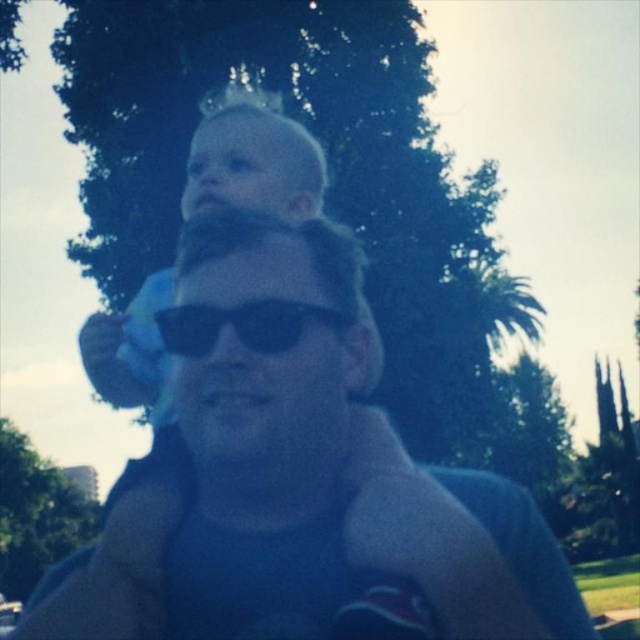
From the picture: Does blue fabric shirt at center have a greater width compared to blonde hair baby at upper center?

Indeed, blue fabric shirt at center has a greater width compared to blonde hair baby at upper center.

Between blue fabric shirt at center and blonde hair baby at upper center, which one has more height?

Standing taller between the two is blue fabric shirt at center.

Which is in front, point (186, 364) or point (317, 157)?

Point (186, 364)

Locate an element on the screen. blue fabric shirt at center is located at coordinates (298, 476).

Between blonde hair baby at upper center and black plastic sunglasses at center, which one is positioned lower?

black plastic sunglasses at center

Is blonde hair baby at upper center thinner than black plastic sunglasses at center?

No, blonde hair baby at upper center is not thinner than black plastic sunglasses at center.

Does point (131, 353) come in front of point (196, 317)?

That is False.

The width and height of the screenshot is (640, 640). What are the coordinates of `blonde hair baby at upper center` in the screenshot? It's located at (252, 157).

Is blue fabric shirt at center behind black plastic sunglasses at center?

No, blue fabric shirt at center is in front of black plastic sunglasses at center.

Between blue fabric shirt at center and black plastic sunglasses at center, which one has more height?

With more height is blue fabric shirt at center.

This screenshot has width=640, height=640. What do you see at coordinates (298, 476) in the screenshot?
I see `blue fabric shirt at center` at bounding box center [298, 476].

The height and width of the screenshot is (640, 640). What are the coordinates of `blue fabric shirt at center` in the screenshot? It's located at (298, 476).